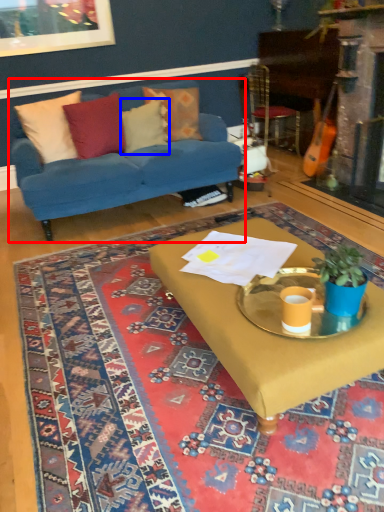
Question: Which point is further to the camera, studio couch (highlighted by a red box) or pillow (highlighted by a blue box)?

Choices:
 (A) studio couch
 (B) pillow

Answer: (B)